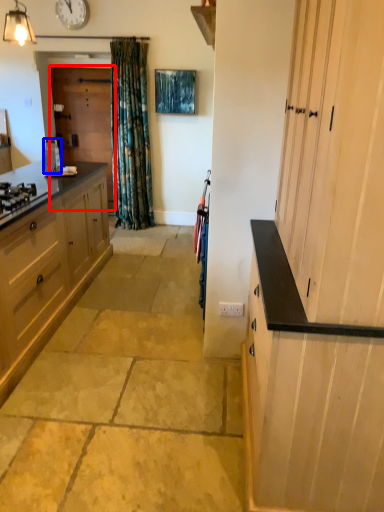
Question: Which of the following is the closest to the observer, screen door (highlighted by a red box) or appliance (highlighted by a blue box)?

Choices:
 (A) screen door
 (B) appliance

Answer: (B)